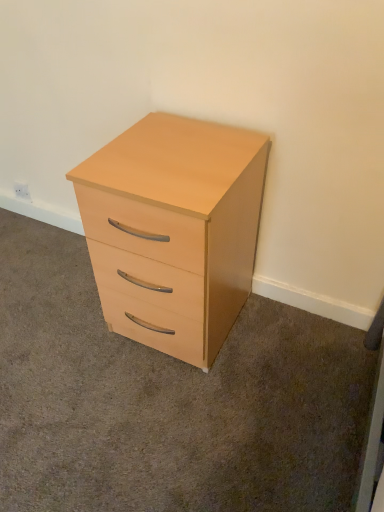
Question: In which direction should I rotate to look at light wood/finish chest of drawers at center?

Choices:
 (A) left
 (B) right

Answer: (A)

Question: Is white plastic electric outlet at upper left placed right next to light wood/finish chest of drawers at center?

Choices:
 (A) no
 (B) yes

Answer: (A)

Question: Is white plastic electric outlet at upper left not inside light wood/finish chest of drawers at center?

Choices:
 (A) no
 (B) yes

Answer: (B)

Question: Is white plastic electric outlet at upper left taller than light wood/finish chest of drawers at center?

Choices:
 (A) yes
 (B) no

Answer: (B)

Question: Considering the relative sizes of white plastic electric outlet at upper left and light wood/finish chest of drawers at center in the image provided, is white plastic electric outlet at upper left shorter than light wood/finish chest of drawers at center?

Choices:
 (A) no
 (B) yes

Answer: (B)

Question: From a real-world perspective, does white plastic electric outlet at upper left sit lower than light wood/finish chest of drawers at center?

Choices:
 (A) yes
 (B) no

Answer: (A)

Question: Is white plastic electric outlet at upper left closer to camera compared to light wood/finish chest of drawers at center?

Choices:
 (A) yes
 (B) no

Answer: (B)

Question: Does light wood/finish chest of drawers at center have a smaller size compared to white plastic electric outlet at upper left?

Choices:
 (A) no
 (B) yes

Answer: (A)

Question: From a real-world perspective, is light wood/finish chest of drawers at center positioned over white plastic electric outlet at upper left based on gravity?

Choices:
 (A) yes
 (B) no

Answer: (A)

Question: Would you say light wood/finish chest of drawers at center is outside white plastic electric outlet at upper left?

Choices:
 (A) yes
 (B) no

Answer: (A)

Question: Does light wood/finish chest of drawers at center come in front of white plastic electric outlet at upper left?

Choices:
 (A) no
 (B) yes

Answer: (B)

Question: Is the position of light wood/finish chest of drawers at center more distant than that of white plastic electric outlet at upper left?

Choices:
 (A) yes
 (B) no

Answer: (B)

Question: Is light wood/finish chest of drawers at center directly adjacent to white plastic electric outlet at upper left?

Choices:
 (A) no
 (B) yes

Answer: (A)

Question: From the image's perspective, is white plastic electric outlet at upper left above or below light wood/finish chest of drawers at center?

Choices:
 (A) below
 (B) above

Answer: (B)